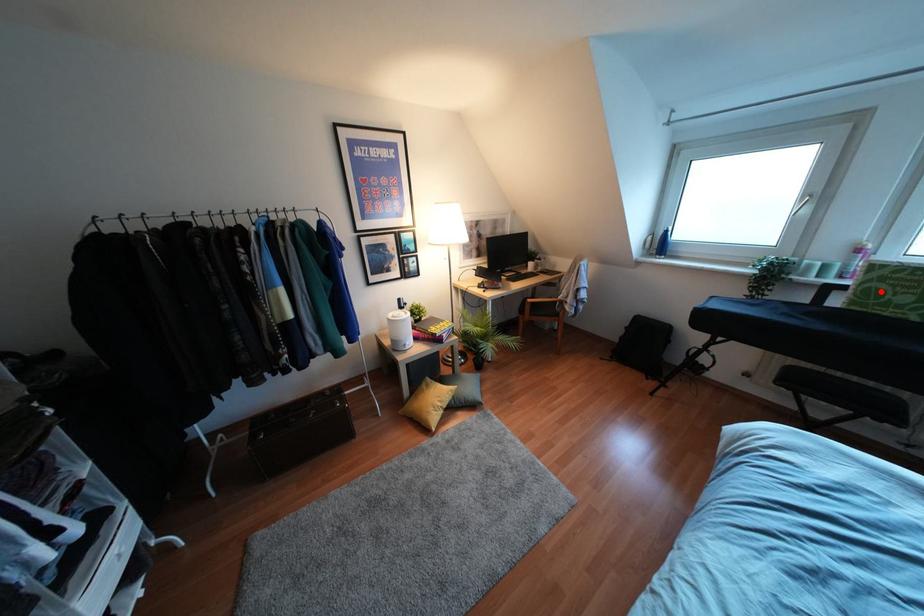
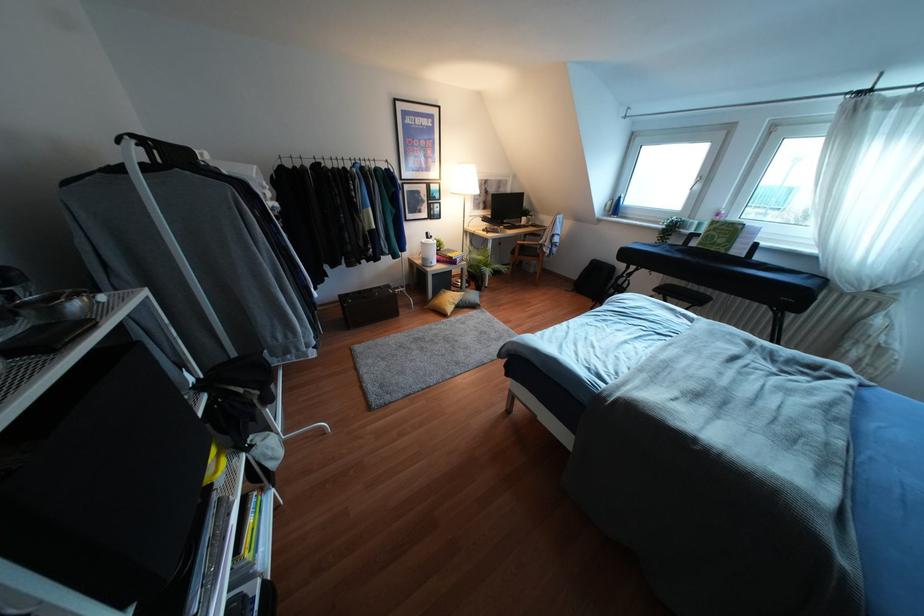
Question: I am providing you with two images of the same scene from different viewpoints. A red point is shown in image1. For the corresponding object point in image2, is it positioned nearer or farther from the camera?

Choices:
 (A) Nearer
 (B) Farther

Answer: (A)